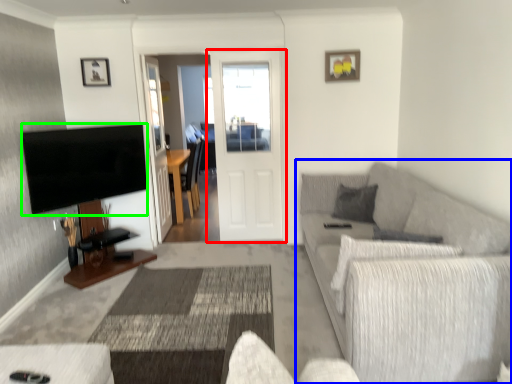
Question: Which is nearer to the door (highlighted by a red box)? studio couch (highlighted by a blue box) or television (highlighted by a green box).

Choices:
 (A) studio couch
 (B) television

Answer: (B)